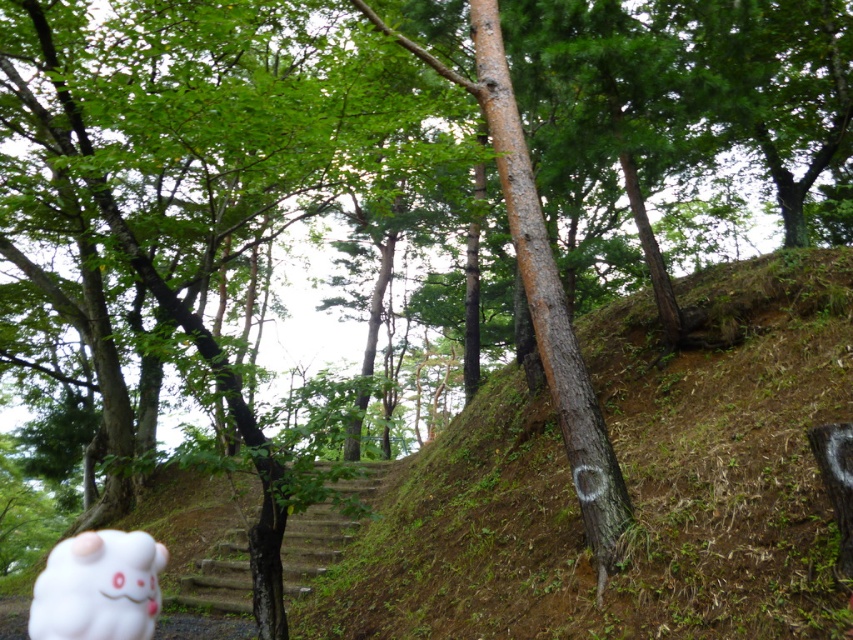
You are standing at the bottom of the stone steps in the midground and want to walk towards the top. There are two points marked on the path, point A at coordinates point (x=616, y=579) and point B at coordinates point (x=386, y=464). Which point should you reach first as you climb the steps?

Point A at coordinates point (x=616, y=579) is in front of point B at coordinates point (x=386, y=464), so you will reach point A first as you climb the steps.

You are a hiker who wants to place a small flag exactly halfway between the brown dirt hillside at center and the white fluffy plushie at lower left. Which object will the flag be closer to?

The flag will be closer to the white fluffy plushie at lower left because the brown dirt hillside at center is taller, so the halfway point would be nearer to the shorter object.

You are a hiker who has just spotted the white fluffy plushie at lower left and the smooth concrete stairs at center in the forest. Which object is closer to you based on their size?

The white fluffy plushie at lower left is smaller than the smooth concrete stairs at center, which suggests it is farther away since smaller objects in the distance appear smaller.